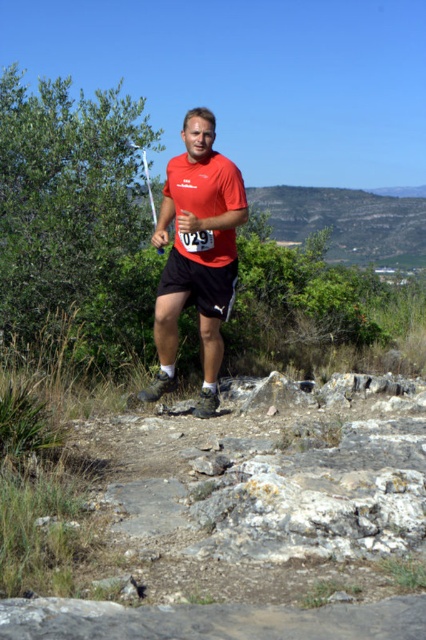
Question: Is rugged stone hillside at upper center further to the viewer compared to black matte shorts at center?

Choices:
 (A) no
 (B) yes

Answer: (B)

Question: Estimate the real-world distances between objects in this image. Which object is closer to the matte red shirt at center?

Choices:
 (A) rugged stone hillside at upper center
 (B) black matte shorts at center

Answer: (B)

Question: Considering the relative positions of matte red shirt at center and black matte shorts at center in the image provided, where is matte red shirt at center located with respect to black matte shorts at center?

Choices:
 (A) left
 (B) right

Answer: (A)

Question: Which of the following is the farthest from the observer?

Choices:
 (A) black matte shorts at center
 (B) rugged stone hillside at upper center
 (C) matte red shirt at center

Answer: (B)

Question: Does matte red shirt at center appear on the right side of black matte shorts at center?

Choices:
 (A) no
 (B) yes

Answer: (A)

Question: Which point is closer to the camera taking this photo?

Choices:
 (A) (198, 193)
 (B) (273, 193)
 (C) (187, 282)

Answer: (A)